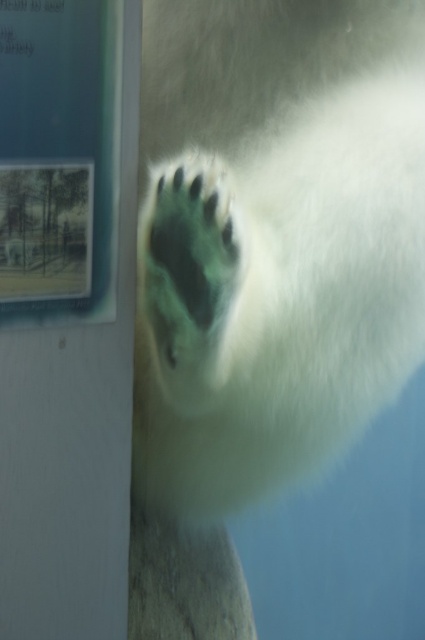
Which is more to the right, white fur paw at center or green fur paw at center?

white fur paw at center is more to the right.

Where is `white fur paw at center`? The height and width of the screenshot is (640, 425). white fur paw at center is located at coordinates (272, 237).

Is point (419, 333) positioned before point (164, 285)?

No, (419, 333) is behind (164, 285).

Image resolution: width=425 pixels, height=640 pixels. What are the coordinates of `white fur paw at center` in the screenshot? It's located at (272, 237).